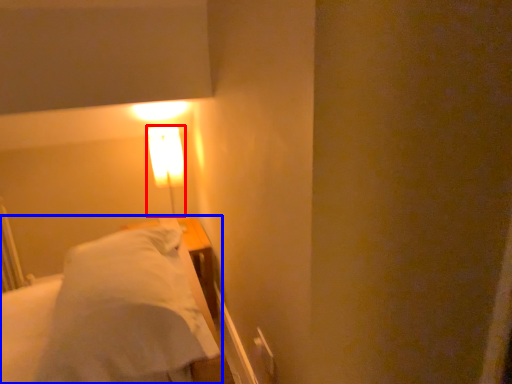
Question: Among these objects, which one is nearest to the camera, lamp (highlighted by a red box) or bed (highlighted by a blue box)?

Choices:
 (A) lamp
 (B) bed

Answer: (B)